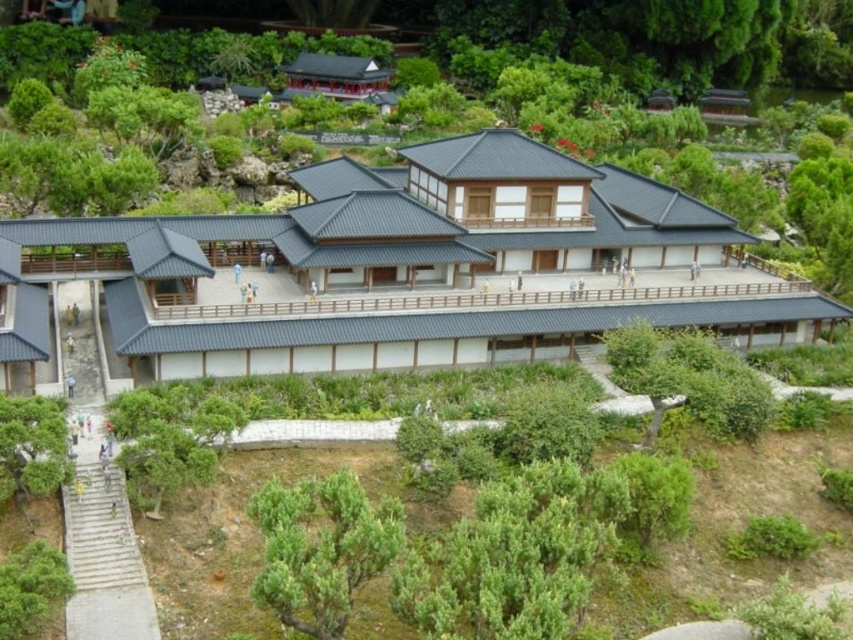
Question: Is green leafy shrub at lower center wider than green leafy tree at lower left?

Choices:
 (A) no
 (B) yes

Answer: (B)

Question: Can you confirm if green leafy shrub at lower center is thinner than green leafy tree at lower left?

Choices:
 (A) no
 (B) yes

Answer: (A)

Question: Which point appears closest to the camera in this image?

Choices:
 (A) (294, 541)
 (B) (51, 476)

Answer: (A)

Question: Can you confirm if green leafy shrub at lower center is smaller than green leafy tree at lower left?

Choices:
 (A) no
 (B) yes

Answer: (A)

Question: Which point is farther to the camera?

Choices:
 (A) (256, 513)
 (B) (51, 445)

Answer: (B)